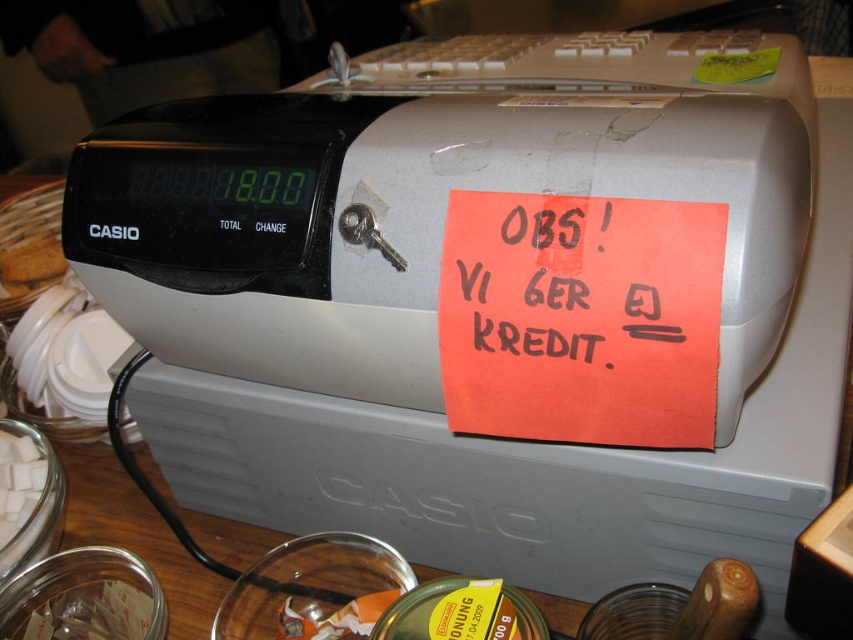
Question: Which of the following is the closest to the observer?

Choices:
 (A) orange paper at center
 (B) white sugar cubes at lower left
 (C) brown crumbly at left
 (D) yellow paper at top right

Answer: (A)

Question: Can you confirm if brown crumbly at left is positioned below yellow paper at top right?

Choices:
 (A) yes
 (B) no

Answer: (A)

Question: Is white sugar cubes at lower left to the right of brown crumbly at left from the viewer's perspective?

Choices:
 (A) no
 (B) yes

Answer: (B)

Question: Which point appears farthest from the camera in this image?

Choices:
 (A) (654, 260)
 (B) (3, 548)
 (C) (761, 64)
 (D) (28, 259)

Answer: (D)

Question: Is the position of brown crumbly at left less distant than that of yellow paper at top right?

Choices:
 (A) yes
 (B) no

Answer: (B)

Question: Considering the real-world distances, which object is farthest from the white sugar cubes at lower left?

Choices:
 (A) yellow paper at top right
 (B) brown crumbly at left

Answer: (A)